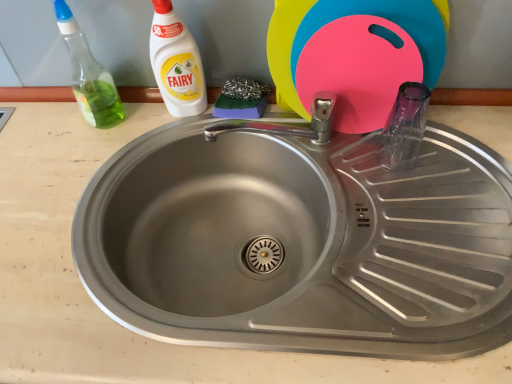
Question: Is the depth of transparent glass bottle at right greater than that of pink plastic cutting board at upper right?

Choices:
 (A) no
 (B) yes

Answer: (B)

Question: From the image's perspective, is transparent glass bottle at right beneath pink plastic cutting board at upper right?

Choices:
 (A) yes
 (B) no

Answer: (A)

Question: Considering the relative sizes of transparent glass bottle at right and pink plastic cutting board at upper right in the image provided, is transparent glass bottle at right shorter than pink plastic cutting board at upper right?

Choices:
 (A) no
 (B) yes

Answer: (B)

Question: From a real-world perspective, is transparent glass bottle at right on top of pink plastic cutting board at upper right?

Choices:
 (A) yes
 (B) no

Answer: (B)

Question: Does transparent glass bottle at right turn towards pink plastic cutting board at upper right?

Choices:
 (A) no
 (B) yes

Answer: (A)

Question: Looking at their shapes, would you say white plastic bottle at upper left, which is counted as the 1th cleaning product, starting from the right, is wider or thinner than green translucent spray bottle at left, which is counted as the first cleaning product, starting from the left?

Choices:
 (A) thin
 (B) wide

Answer: (A)

Question: From a real-world perspective, relative to green translucent spray bottle at left, marked as the second cleaning product in a right-to-left arrangement, is white plastic bottle at upper left, which is counted as the 1th cleaning product, starting from the right, vertically above or below?

Choices:
 (A) below
 (B) above

Answer: (A)

Question: Is point [185, 64] closer or farther from the camera than point [87, 51]?

Choices:
 (A) closer
 (B) farther

Answer: (A)

Question: Relative to green translucent spray bottle at left, which is counted as the first cleaning product, starting from the left, is white plastic bottle at upper left, which is counted as the 1th cleaning product, starting from the right, in front or behind?

Choices:
 (A) front
 (B) behind

Answer: (B)

Question: Looking at their shapes, would you say white plastic bottle at upper left, placed as the 2th cleaning product when sorted from left to right, is wider or thinner than pink plastic cutting board at upper right?

Choices:
 (A) thin
 (B) wide

Answer: (A)

Question: In the image, is white plastic bottle at upper left, which is counted as the 1th cleaning product, starting from the right, on the left side or the right side of pink plastic cutting board at upper right?

Choices:
 (A) left
 (B) right

Answer: (A)

Question: Do you think white plastic bottle at upper left, placed as the 2th cleaning product when sorted from left to right, is within pink plastic cutting board at upper right, or outside of it?

Choices:
 (A) inside
 (B) outside

Answer: (B)

Question: In terms of size, does white plastic bottle at upper left, which is counted as the 1th cleaning product, starting from the right, appear bigger or smaller than pink plastic cutting board at upper right?

Choices:
 (A) big
 (B) small

Answer: (B)

Question: Considering the relative positions of stainless steel sink at center and white plastic bottle at upper left, which is counted as the 1th cleaning product, starting from the right, in the image provided, is stainless steel sink at center to the left or to the right of white plastic bottle at upper left, which is counted as the 1th cleaning product, starting from the right,?

Choices:
 (A) right
 (B) left

Answer: (A)

Question: From their relative heights in the image, would you say stainless steel sink at center is taller or shorter than white plastic bottle at upper left, which is counted as the 1th cleaning product, starting from the right?

Choices:
 (A) tall
 (B) short

Answer: (A)